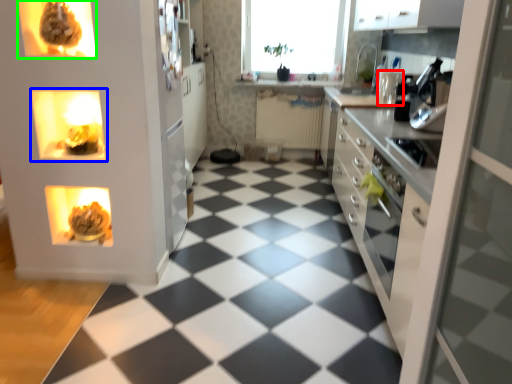
Question: Which is nearer to the appliance (highlighted by a red box)? shelf (highlighted by a blue box) or appliance (highlighted by a green box).

Choices:
 (A) shelf
 (B) appliance

Answer: (A)